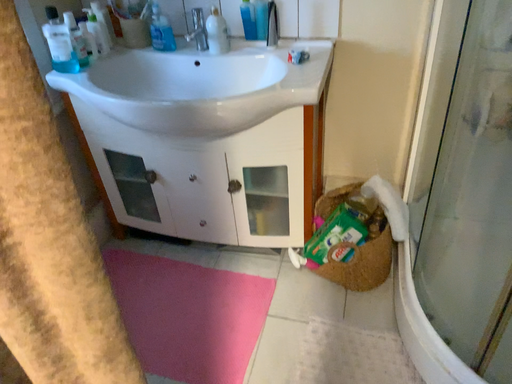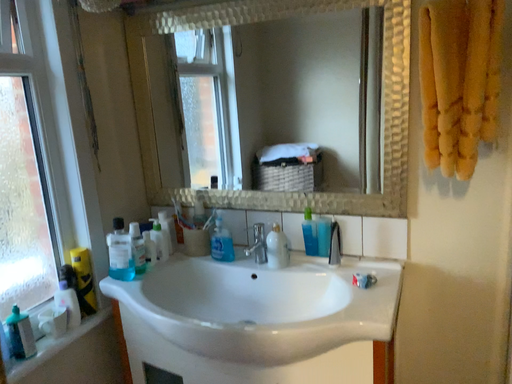
Question: Which way did the camera rotate in the video?

Choices:
 (A) rotated right
 (B) rotated left

Answer: (B)